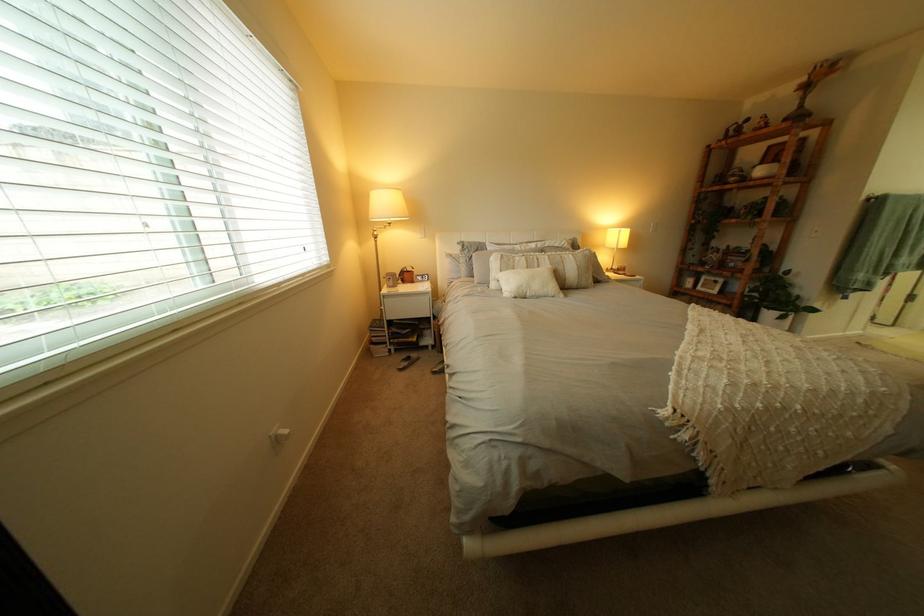
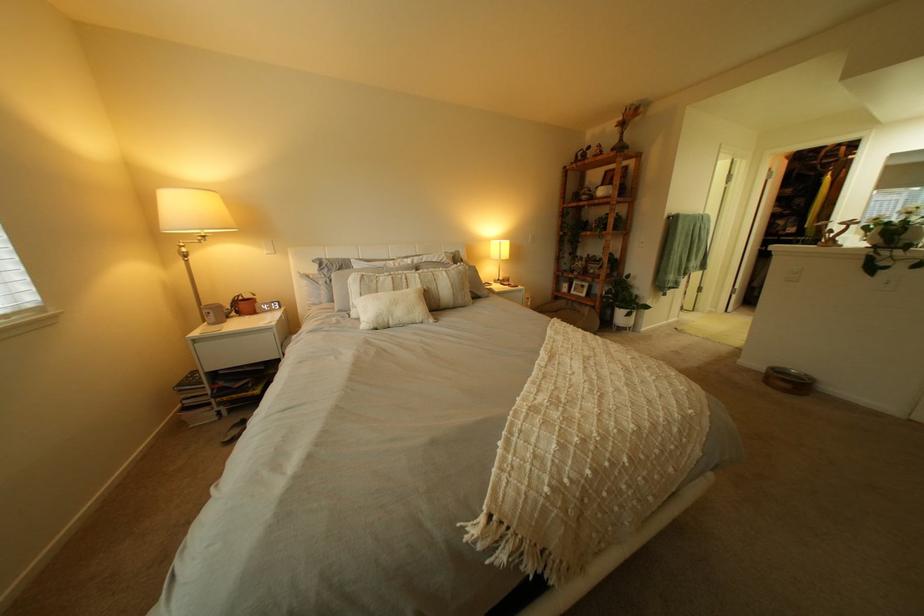
In the second image, find the point that corresponds to the point at 698,347 in the first image.

(541, 387)